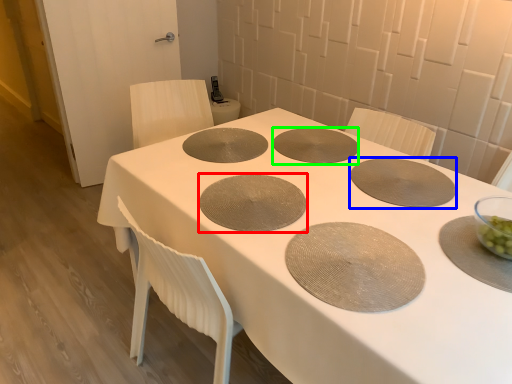
Question: Which object is positioned farthest from pizza pan (highlighted by a red box)? Select from pizza pan (highlighted by a blue box) and pizza pan (highlighted by a green box).

Choices:
 (A) pizza pan
 (B) pizza pan

Answer: (A)